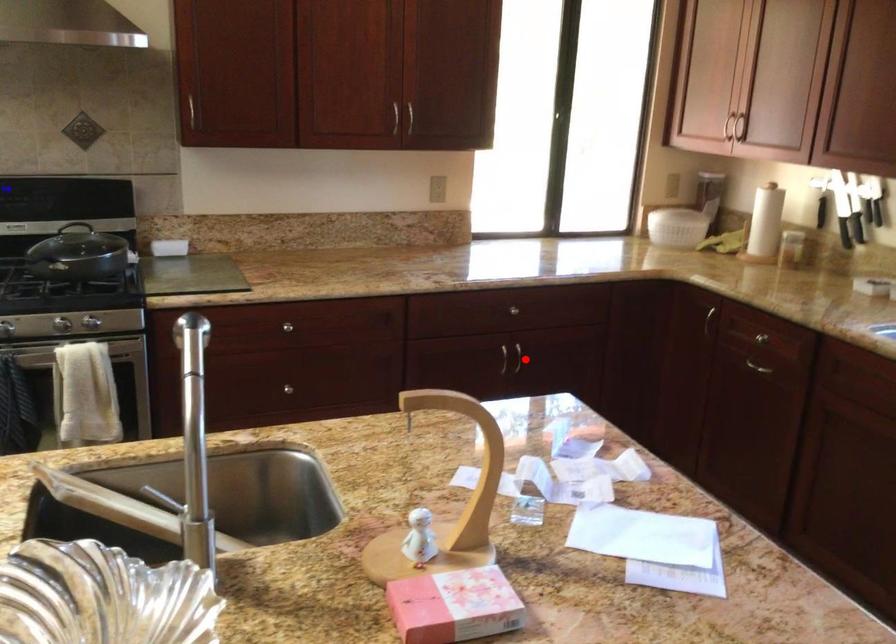
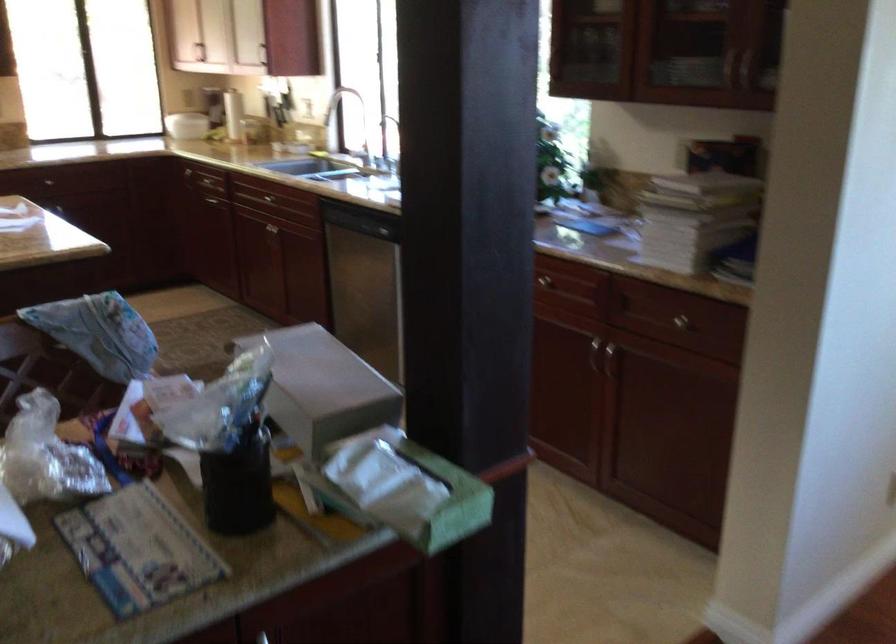
Question: I am providing you with two images of the same scene from different viewpoints. A red point is shown in image1. For the corresponding object point in image2, is it positioned nearer or farther from the camera?

Choices:
 (A) Nearer
 (B) Farther

Answer: (B)